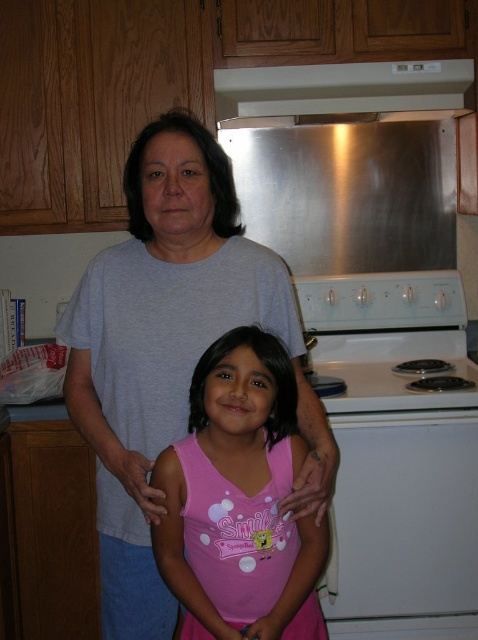
You are a photographer trying to capture a photo of the gray cotton shirt at upper center and the pink fabric shirt at center. Which of the two shirts is closer to the camera?

The gray cotton shirt at upper center is closer to the camera because the pink fabric shirt at center is behind it.

Where is the gray cotton shirt at upper center located in the image?

The gray cotton shirt at upper center is located at point (171, 352).